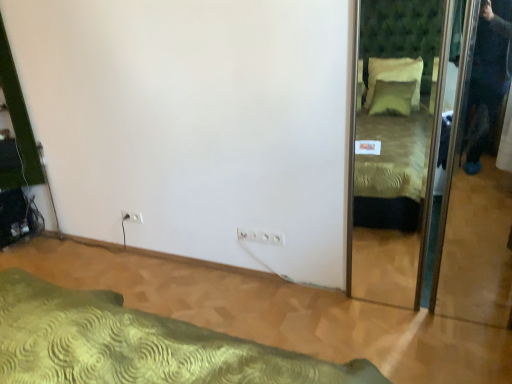
Identify the location of free region under green textured mirror at right (from a real-world perspective). The height and width of the screenshot is (384, 512). (434, 320).